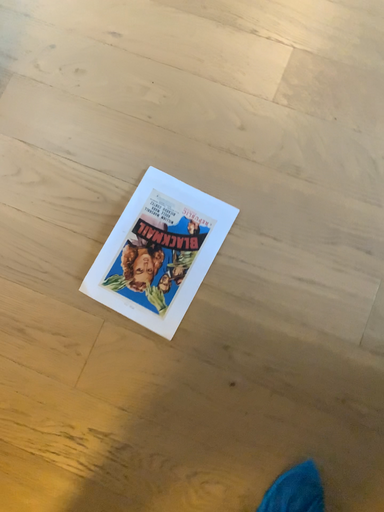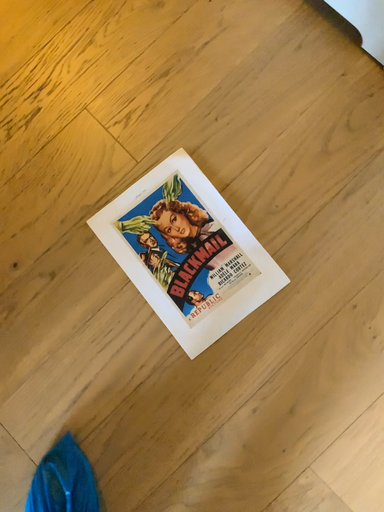
Question: Which way did the camera rotate in the video?

Choices:
 (A) rotated right
 (B) rotated left

Answer: (B)